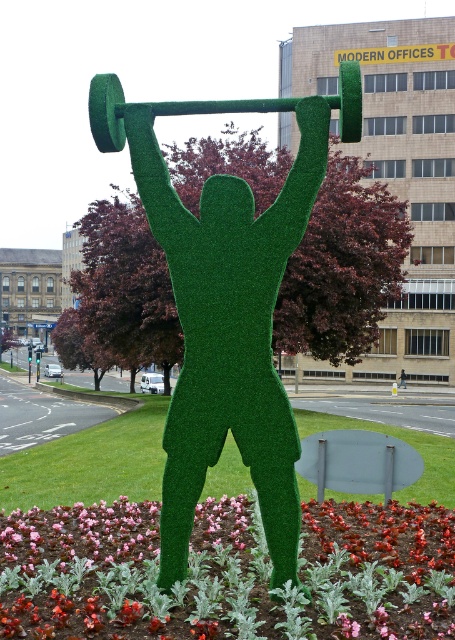
Question: Which object is closer to the camera taking this photo?

Choices:
 (A) green grassy barbell at upper center
 (B) pink fabric flower at center
 (C) green grassy figure at center

Answer: (B)

Question: Where is pink fabric flower at center located in relation to green grassy barbell at upper center in the image?

Choices:
 (A) below
 (B) above

Answer: (A)

Question: Is green grassy figure at center behind green grassy barbell at upper center?

Choices:
 (A) no
 (B) yes

Answer: (A)

Question: Which of the following is the closest to the observer?

Choices:
 (A) green grassy barbell at upper center
 (B) green grassy figure at center

Answer: (B)

Question: Estimate the real-world distances between objects in this image. Which object is closer to the green grassy barbell at upper center?

Choices:
 (A) pink fabric flower at center
 (B) green grassy figure at center

Answer: (B)

Question: Can you confirm if green grassy figure at center is wider than green grassy barbell at upper center?

Choices:
 (A) no
 (B) yes

Answer: (A)